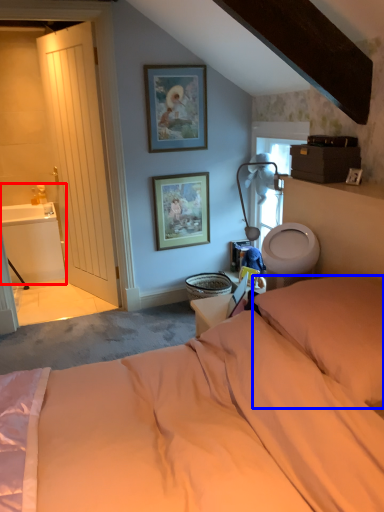
Question: Which object appears farthest to the camera in this image, sink (highlighted by a red box) or pillow (highlighted by a blue box)?

Choices:
 (A) sink
 (B) pillow

Answer: (A)